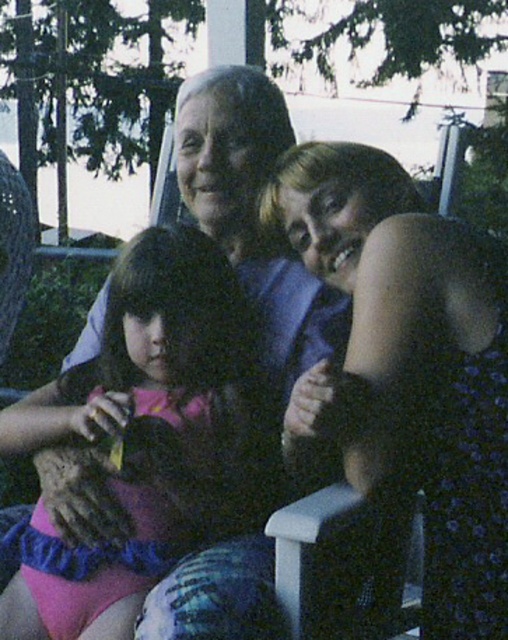
You are a photographer trying to capture a closeup of the pink fabric dress at center without the matte blue dress at center blocking the view. Is this possible given their positions?

The matte blue dress at center is closer to the viewer than the pink fabric dress at center, so it would block the view of the pink fabric dress at center. Therefore, it is not possible to capture a closeup of the pink fabric dress at center without the matte blue dress at center blocking the view.

You are a photographer planning to take a group photo of the two people wearing the matte blue dress at center and the pink fabric dress at center. Which dress should you focus on first if you want to ensure the taller person is in focus?

The matte blue dress at center is taller than the pink fabric dress at center, so you should focus on the matte blue dress at center first to ensure the taller person is in focus.

You are organizing a clothing donation drive and need to categorize the dresses based on their sizes. You have two dresses in front of you, the matte blue dress at center and the pink fabric dress at center. Which dress should you place in the small size bin?

The matte blue dress at center has a smaller size compared to the pink fabric dress at center, so it should be placed in the small size bin.